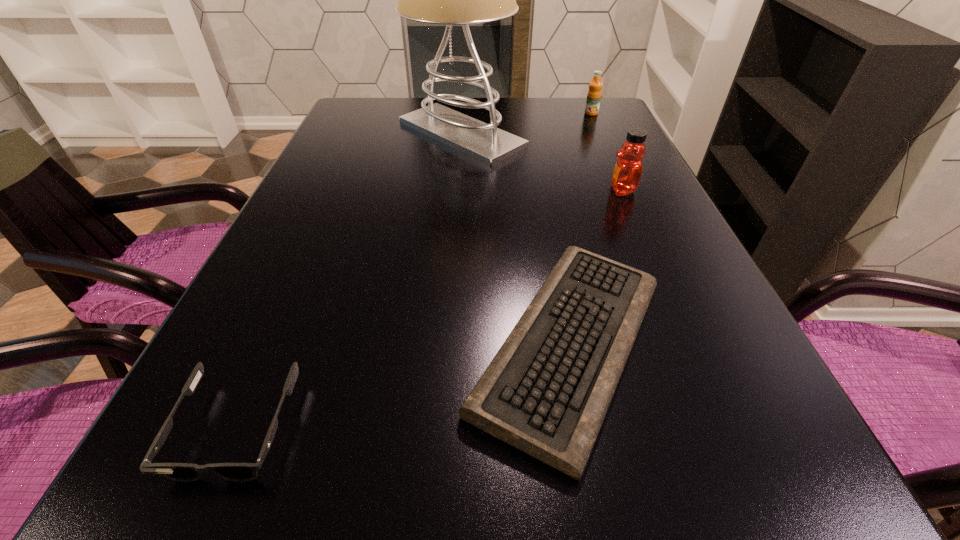
Where is `the tallest object`? This screenshot has width=960, height=540. the tallest object is located at coordinates [449, 0].

Locate an element on the screen. The width and height of the screenshot is (960, 540). the fourth shortest object is located at coordinates (626, 177).

Locate an element on the screen. honey is located at coordinates [626, 177].

In order to click on orange juice in this screenshot , I will do `click(594, 93)`.

Where is `the leftmost object`? The width and height of the screenshot is (960, 540). the leftmost object is located at coordinates (182, 472).

I want to click on computer keyboard, so click(x=546, y=392).

Where is `free location located on the right of the table lamp`? Image resolution: width=960 pixels, height=540 pixels. free location located on the right of the table lamp is located at coordinates (591, 134).

I want to click on vacant space located 0.140m on the front label of the honey, so click(x=547, y=191).

At what (x,y) coordinates should I click in order to perform the action: click on free region located 0.210m on the front label of the honey. Please return your answer as a coordinate pair (x, y). The image size is (960, 540). Looking at the image, I should click on (516, 191).

This screenshot has width=960, height=540. What are the coordinates of `vacant space situated on the front label of the honey` in the screenshot? It's located at (556, 191).